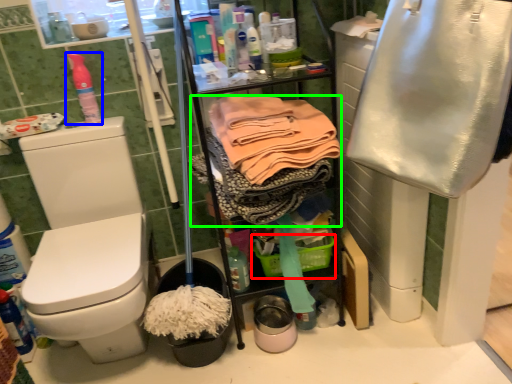
Question: Estimate the real-world distances between objects in this image. Which object is farther from basket (highlighted by a red box), cleaning product (highlighted by a blue box) or clothing (highlighted by a green box)?

Choices:
 (A) cleaning product
 (B) clothing

Answer: (A)